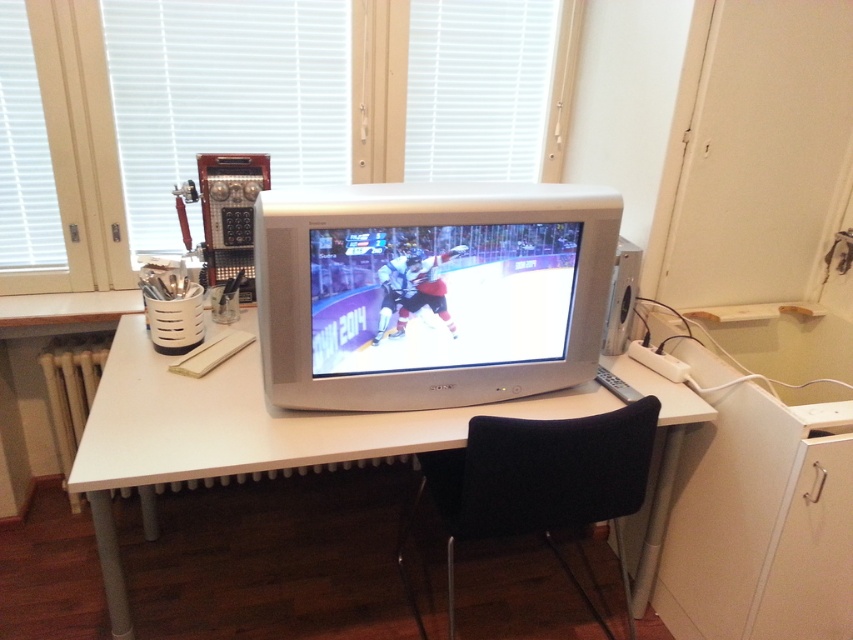
You are setting up a new desk arrangement and want to place a lamp exactly 0.2 units to the right of the matte gray monitor at center. What coordinate would you use for the lamp?

The lamp should be placed at coordinate x 0.658, y 0.506 since the matte gray monitor at center is at point [431,292] and adding 0.2 to the x coordinate gives 0.658.

You are standing in front of the desk in the image. There is a point marked at coordinates (x=431, y=292). What object is located at that point?

The point at coordinates (x=431, y=292) marks the location of the matte gray monitor at center.